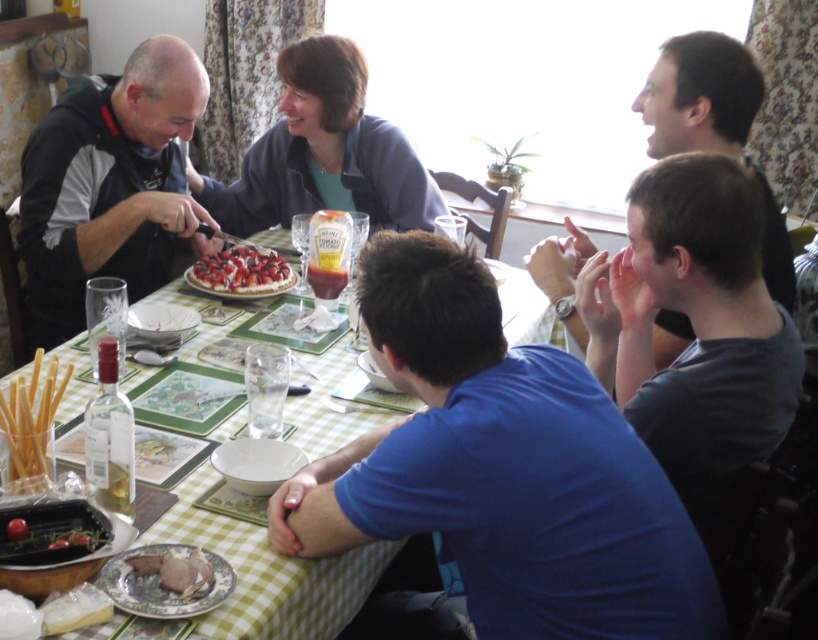
Question: Which point appears farthest from the camera in this image?

Choices:
 (A) (111, 556)
 (B) (619, 273)

Answer: (B)

Question: Can you confirm if green checkered tablecloth at center is smaller than strawberry-topped cake at center?

Choices:
 (A) yes
 (B) no

Answer: (B)

Question: Does matte brown meat at lower left appear on the right side of strawberry-topped cake at center?

Choices:
 (A) no
 (B) yes

Answer: (B)

Question: Which point is closer to the camera?

Choices:
 (A) green checkered tablecloth at center
 (B) gray cotton shirt at right

Answer: (A)

Question: Can you confirm if blue cotton shirt at center is positioned above strawberry-topped cake at center?

Choices:
 (A) no
 (B) yes

Answer: (A)

Question: Which point is closer to the camera?

Choices:
 (A) (315, 582)
 (B) (16, 550)
 (C) (664, 388)
 (D) (474, 257)

Answer: (B)